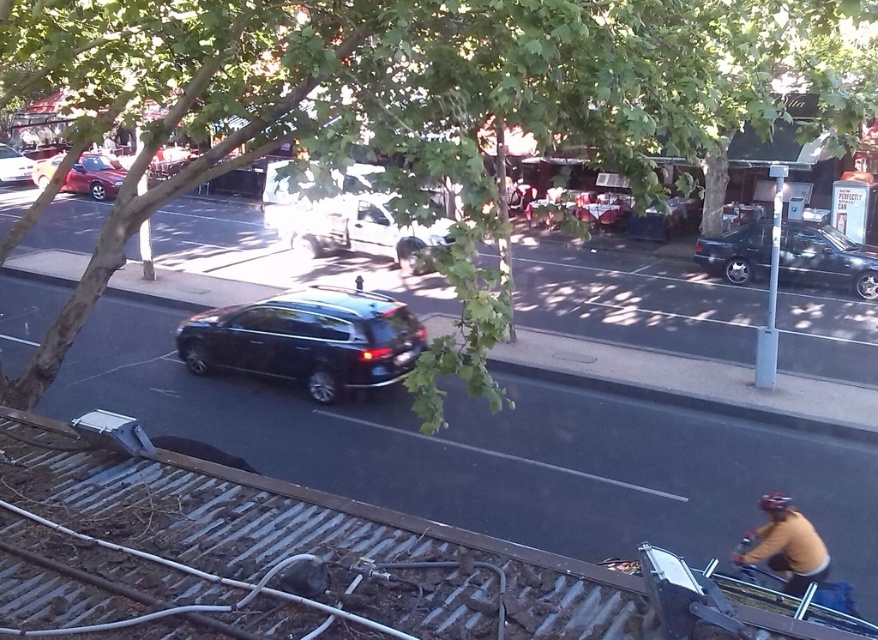
Question: Does green leafy tree at upper center have a larger size compared to white matte van at center?

Choices:
 (A) no
 (B) yes

Answer: (B)

Question: Is white matte van at center wider than shiny red sedan at left?

Choices:
 (A) no
 (B) yes

Answer: (A)

Question: Which point is closer to the camera taking this photo?

Choices:
 (A) (68, 172)
 (B) (120, 605)

Answer: (B)

Question: Among these objects, which one is farthest from the camera?

Choices:
 (A) brown leather jacket at lower right
 (B) shiny silver sedan at left

Answer: (B)

Question: Which point is closer to the camera taking this photo?

Choices:
 (A) (4, 176)
 (B) (535, 12)

Answer: (B)

Question: Considering the relative positions of brown leather jacket at lower right and shiny silver sedan at left in the image provided, where is brown leather jacket at lower right located with respect to shiny silver sedan at left?

Choices:
 (A) below
 (B) above

Answer: (A)